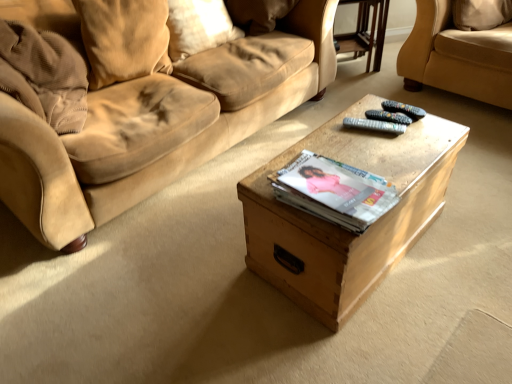
Question: Does suede pillow at upper center, the 1th pillow in the right-to-left sequence, have a lesser height compared to transparent glass table at upper center?

Choices:
 (A) yes
 (B) no

Answer: (A)

Question: From the image's perspective, is suede pillow at upper center, which is counted as the 3th pillow, starting from the left, located above transparent glass table at upper center?

Choices:
 (A) no
 (B) yes

Answer: (B)

Question: Considering the relative positions of suede pillow at upper center, the 1th pillow in the right-to-left sequence, and transparent glass table at upper center in the image provided, is suede pillow at upper center, the 1th pillow in the right-to-left sequence, to the left of transparent glass table at upper center from the viewer's perspective?

Choices:
 (A) no
 (B) yes

Answer: (B)

Question: Is suede pillow at upper center, the 1th pillow in the right-to-left sequence, further to camera compared to transparent glass table at upper center?

Choices:
 (A) yes
 (B) no

Answer: (B)

Question: From a real-world perspective, does suede pillow at upper center, which is counted as the 3th pillow, starting from the left, sit lower than transparent glass table at upper center?

Choices:
 (A) yes
 (B) no

Answer: (B)

Question: Can you confirm if suede pillow at upper center, which is counted as the 3th pillow, starting from the left, is thinner than transparent glass table at upper center?

Choices:
 (A) no
 (B) yes

Answer: (A)

Question: Is suede pillow at upper left, which appears as the 1th pillow when viewed from the left, to the left of black plastic remote at center, which appears as the second remote when ordered from the bottom, from the viewer's perspective?

Choices:
 (A) yes
 (B) no

Answer: (A)

Question: Is suede pillow at upper left, which appears as the 1th pillow when viewed from the left, in front of black plastic remote at center, which appears as the second remote when ordered from the bottom?

Choices:
 (A) no
 (B) yes

Answer: (A)

Question: From the image's perspective, is suede pillow at upper left, which appears as the 1th pillow when viewed from the left, on black plastic remote at center, which appears as the second remote when ordered from the bottom?

Choices:
 (A) yes
 (B) no

Answer: (A)

Question: Does suede pillow at upper left, which appears as the 1th pillow when viewed from the left, contain black plastic remote at center, positioned as the first remote in top-to-bottom order?

Choices:
 (A) no
 (B) yes

Answer: (A)

Question: Considering the relative sizes of suede pillow at upper left, which appears as the 1th pillow when viewed from the left, and black plastic remote at center, positioned as the first remote in top-to-bottom order, in the image provided, is suede pillow at upper left, which appears as the 1th pillow when viewed from the left, taller than black plastic remote at center, positioned as the first remote in top-to-bottom order,?

Choices:
 (A) yes
 (B) no

Answer: (A)

Question: Does suede pillow at upper left, which is the third pillow in right-to-left order, have a lesser height compared to black plastic remote at center, positioned as the first remote in top-to-bottom order?

Choices:
 (A) yes
 (B) no

Answer: (B)

Question: Is black plastic remote at center, positioned as the first remote in top-to-bottom order, beside suede pillow at upper center, the 1th pillow in the right-to-left sequence?

Choices:
 (A) yes
 (B) no

Answer: (B)